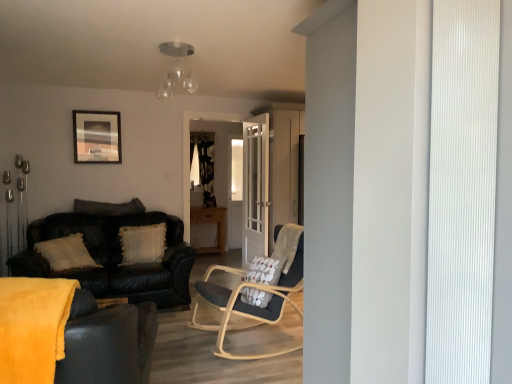
What is the approximate height of white glossy door at center?

The height of white glossy door at center is 6.34 feet.

What is the approximate width of leather couch at left, which is the 1th studio couch in back-to-front order?

The width of leather couch at left, which is the 1th studio couch in back-to-front order, is 3.56 feet.

What do you see at coordinates (248, 304) in the screenshot? The height and width of the screenshot is (384, 512). I see `dark gray fabric chair at center` at bounding box center [248, 304].

What do you see at coordinates (110, 301) in the screenshot? I see `wooden side table at lower left` at bounding box center [110, 301].

The image size is (512, 384). Describe the element at coordinates (109, 207) in the screenshot. I see `white textured pillow at left, which is counted as the second pillow, starting from the bottom` at that location.

Measure the distance between point [135,340] and camera.

Point [135,340] is 1.95 meters away from camera.

At what (x,y) coordinates should I click in order to perform the action: click on wooden picture frame at upper left. Please return your answer as a coordinate pair (x, y). This screenshot has width=512, height=384. Looking at the image, I should click on (97, 137).

Image resolution: width=512 pixels, height=384 pixels. Identify the location of white glossy door at center. (255, 188).

Where is `pillow that is the 1st one below the wooden picture frame at upper left (from a real-world perspective)`? The width and height of the screenshot is (512, 384). pillow that is the 1st one below the wooden picture frame at upper left (from a real-world perspective) is located at coordinates (109, 207).

Can you confirm if white textured pillow at left, which is counted as the second pillow, starting from the bottom, is smaller than wooden picture frame at upper left?

Actually, white textured pillow at left, which is counted as the second pillow, starting from the bottom, might be larger than wooden picture frame at upper left.

Is white textured pillow at left, the first pillow from the top, situated inside wooden picture frame at upper left or outside?

white textured pillow at left, the first pillow from the top, cannot be found inside wooden picture frame at upper left.

In the scene shown: Considering the sizes of objects white textured pillow at left, which is counted as the second pillow, starting from the bottom, and wooden picture frame at upper left in the image provided, who is taller, white textured pillow at left, which is counted as the second pillow, starting from the bottom, or wooden picture frame at upper left?

wooden picture frame at upper left.

Is there a large distance between velvet dark brown couch at left, the 2th studio couch from the back, and dark gray fabric chair at center?

Yes, velvet dark brown couch at left, the 2th studio couch from the back, and dark gray fabric chair at center are located far from each other.

Which is in front, point (51, 346) or point (238, 295)?

The point (51, 346) is closer to the camera.

Which of these two, velvet dark brown couch at left, arranged as the 1th studio couch when viewed from the front, or dark gray fabric chair at center, is wider?

velvet dark brown couch at left, arranged as the 1th studio couch when viewed from the front, is wider.

Which object is closer to the camera, velvet dark brown couch at left, the 2th studio couch from the back, or dark gray fabric chair at center?

Positioned in front is velvet dark brown couch at left, the 2th studio couch from the back.

Is white glossy door at center at the left side of wooden picture frame at upper left?

No, white glossy door at center is not to the left of wooden picture frame at upper left.

From a real-world perspective, is white glossy door at center positioned under wooden picture frame at upper left based on gravity?

Correct, in the physical world, white glossy door at center is lower than wooden picture frame at upper left.

Looking at their sizes, would you say white glossy door at center is wider or thinner than wooden picture frame at upper left?

white glossy door at center is wider than wooden picture frame at upper left.

From the image's perspective, is white glossy door at center located above or below wooden picture frame at upper left?

Based on their image positions, white glossy door at center is located beneath wooden picture frame at upper left.

Could you tell me if wooden side table at lower left is facing wooden picture frame at upper left?

No, wooden side table at lower left is not turned towards wooden picture frame at upper left.

Is point (106, 305) closer to viewer compared to point (82, 126)?

Yes, it is in front of point (82, 126).

From a real-world perspective, between wooden side table at lower left and wooden picture frame at upper left, who is vertically higher?

wooden picture frame at upper left, from a real-world perspective.

Is wooden side table at lower left far away from wooden picture frame at upper left?

Yes.

Is wooden side table at lower left in front of or behind white glossy door at center in the image?

In the image, wooden side table at lower left appears in front of white glossy door at center.

Can you confirm if wooden side table at lower left is bigger than white glossy door at center?

No.

Based on the photo, between wooden side table at lower left and white glossy door at center, which one appears on the right side from the viewer's perspective?

white glossy door at center.

Would you say wooden side table at lower left is outside white glossy door at center?

Yes, wooden side table at lower left is not within white glossy door at center.

Can you see white textured pillow at left, which is counted as the second pillow, starting from the bottom, touching wooden side table at lower left?

No.

From a real-world perspective, is white textured pillow at left, the first pillow from the top, positioned under wooden side table at lower left based on gravity?

No, from a real-world perspective, white textured pillow at left, the first pillow from the top, is not under wooden side table at lower left.

Considering the relative positions of white textured pillow at left, which is counted as the second pillow, starting from the bottom, and wooden side table at lower left in the image provided, is white textured pillow at left, which is counted as the second pillow, starting from the bottom, behind wooden side table at lower left?

Yes, it is.

Is white textured pillow at left, the first pillow from the top, not inside wooden side table at lower left?

Yes, white textured pillow at left, the first pillow from the top, is not within wooden side table at lower left.

Between wooden picture frame at upper left and white textured pillow at center, arranged as the 2th pillow when viewed from the top, which one appears on the left side from the viewer's perspective?

wooden picture frame at upper left.

From the image's perspective, count 2nd pillows downward from the wooden picture frame at upper left and point to it. Please provide its 2D coordinates.

[(143, 243)]

From the image's perspective, which is above, wooden picture frame at upper left or white textured pillow at center, which is the 1th pillow in bottom-to-top order?

wooden picture frame at upper left.

From a real-world perspective, does wooden picture frame at upper left stand above white textured pillow at center, which is the 1th pillow in bottom-to-top order?

Correct, in the physical world, wooden picture frame at upper left is higher than white textured pillow at center, which is the 1th pillow in bottom-to-top order.

From the image's perspective, starting from the wooden picture frame at upper left, which pillow is the 1st one below? Please provide its 2D coordinates.

[(109, 207)]

Identify the location of chair behind the velvet dark brown couch at left, arranged as the 1th studio couch when viewed from the front. The image size is (512, 384). (248, 304).

Which object lies further to the anchor point white textured pillow at left, the first pillow from the top, white glossy door at center or white textured pillow at center, which is the 1th pillow in bottom-to-top order?

white glossy door at center is further to white textured pillow at left, the first pillow from the top.

Which object lies further to the anchor point wooden side table at lower left, white glossy door at center or clear glass chandelier at upper center?

Based on the image, clear glass chandelier at upper center appears to be further to wooden side table at lower left.

Considering their positions, is leather couch at left, which is the 1th studio couch in back-to-front order, positioned closer to velvet dark brown couch at left, arranged as the 1th studio couch when viewed from the front, than clear glass chandelier at upper center?

The object closer to velvet dark brown couch at left, arranged as the 1th studio couch when viewed from the front, is clear glass chandelier at upper center.

When comparing their distances from velvet dark brown couch at left, arranged as the 1th studio couch when viewed from the front, does dark gray fabric chair at center or white glossy door at center seem further?

white glossy door at center is further to velvet dark brown couch at left, arranged as the 1th studio couch when viewed from the front.

Based on their spatial positions, is light brown wooden table at center or leather couch at left, which is the 1th studio couch in back-to-front order, closer to clear glass chandelier at upper center?

The object closer to clear glass chandelier at upper center is leather couch at left, which is the 1th studio couch in back-to-front order.

From the image, which object appears to be nearer to dark gray fabric chair at center, clear glass chandelier at upper center or white textured pillow at left, the first pillow from the top?

clear glass chandelier at upper center is closer to dark gray fabric chair at center.

Based on their spatial positions, is clear glass chandelier at upper center or wooden side table at lower left closer to leather couch at left, which is the 1th studio couch in back-to-front order?

wooden side table at lower left lies closer to leather couch at left, which is the 1th studio couch in back-to-front order, than the other object.

Estimate the real-world distances between objects in this image. Which object is closer to white textured pillow at left, the first pillow from the top, dark gray fabric chair at center or white textured pillow at center, which is the 1th pillow in bottom-to-top order?

white textured pillow at center, which is the 1th pillow in bottom-to-top order, is positioned closer to the anchor white textured pillow at left, the first pillow from the top.

Locate an element on the screen. studio couch positioned between clear glass chandelier at upper center and wooden picture frame at upper left from near to far is located at coordinates (114, 257).

Locate an element on the screen. The image size is (512, 384). studio couch between dark gray fabric chair at center and light brown wooden table at center in the front-back direction is located at coordinates (114, 257).

The height and width of the screenshot is (384, 512). Find the location of `studio couch between clear glass chandelier at upper center and light brown wooden table at center from front to back`. studio couch between clear glass chandelier at upper center and light brown wooden table at center from front to back is located at coordinates (114, 257).

Image resolution: width=512 pixels, height=384 pixels. In order to click on light fixture located between dark gray fabric chair at center and white glossy door at center in the depth direction in this screenshot , I will do `click(177, 70)`.